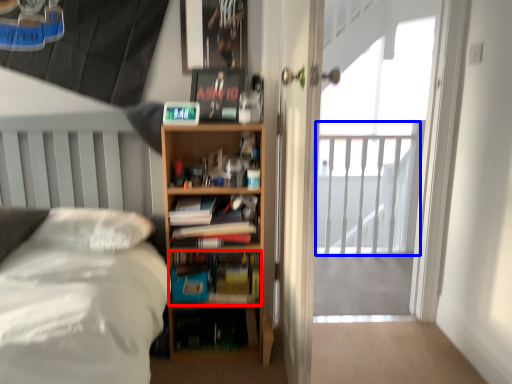
Question: Among these objects, which one is nearest to the camera, book (highlighted by a red box) or balcony (highlighted by a blue box)?

Choices:
 (A) book
 (B) balcony

Answer: (A)